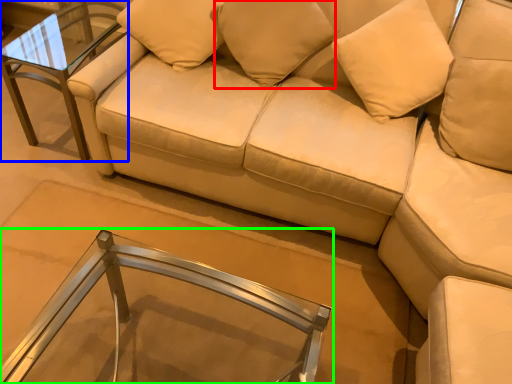
Question: Which is nearer to the pillow (highlighted by a red box)? table (highlighted by a blue box) or table (highlighted by a green box).

Choices:
 (A) table
 (B) table

Answer: (A)